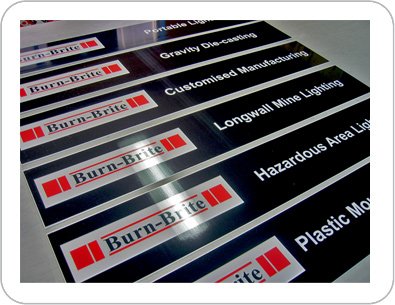
Locate an element on the screen. This screenshot has height=305, width=395. white counter is located at coordinates (365, 62), (35, 263).